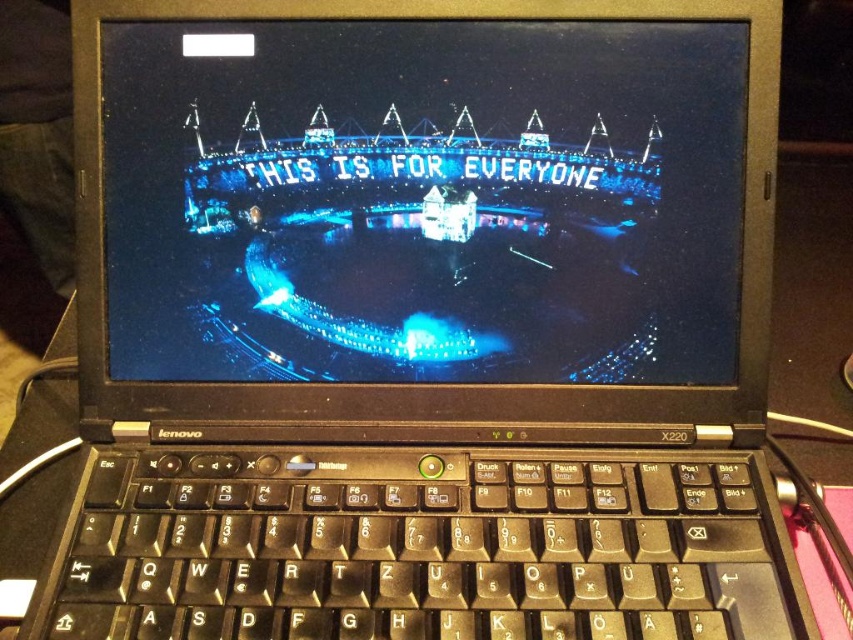
Between point (723, 234) and point (560, 609), which one is positioned in front?

Point (560, 609) is in front.

Who is taller, blue glossy screen at center or black plastic keyboard at center?

blue glossy screen at center is taller.

Find the location of a particular element. The width and height of the screenshot is (853, 640). blue glossy screen at center is located at coordinates coord(422,200).